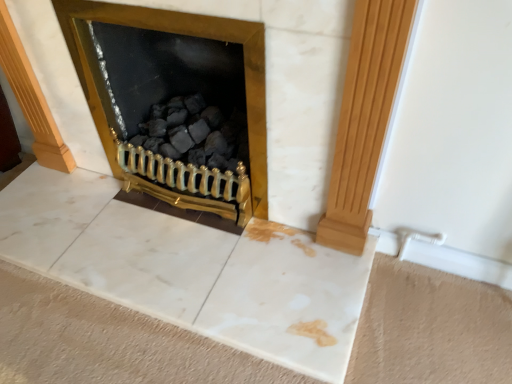
Identify the location of free space in front of light brown wood pillar at right. This screenshot has height=384, width=512. (331, 276).